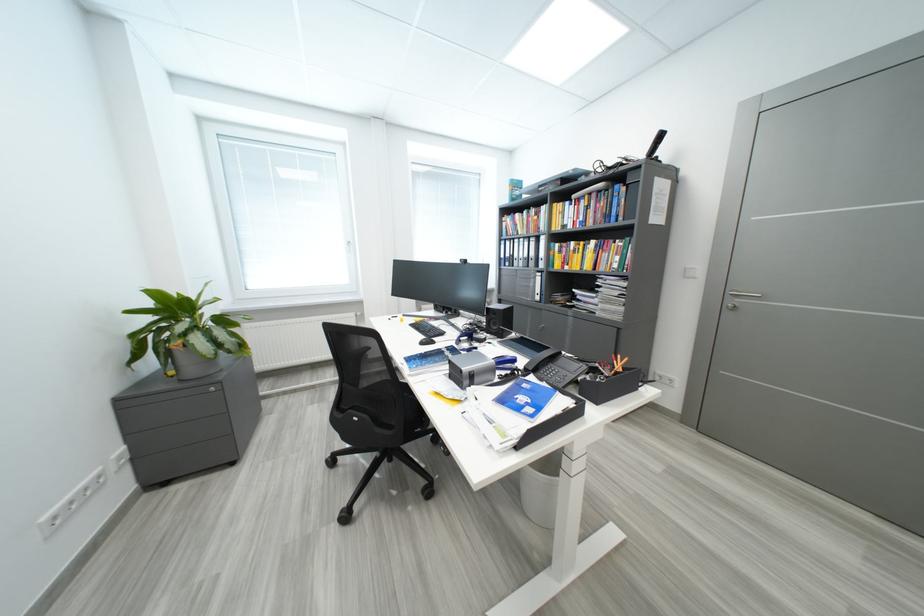
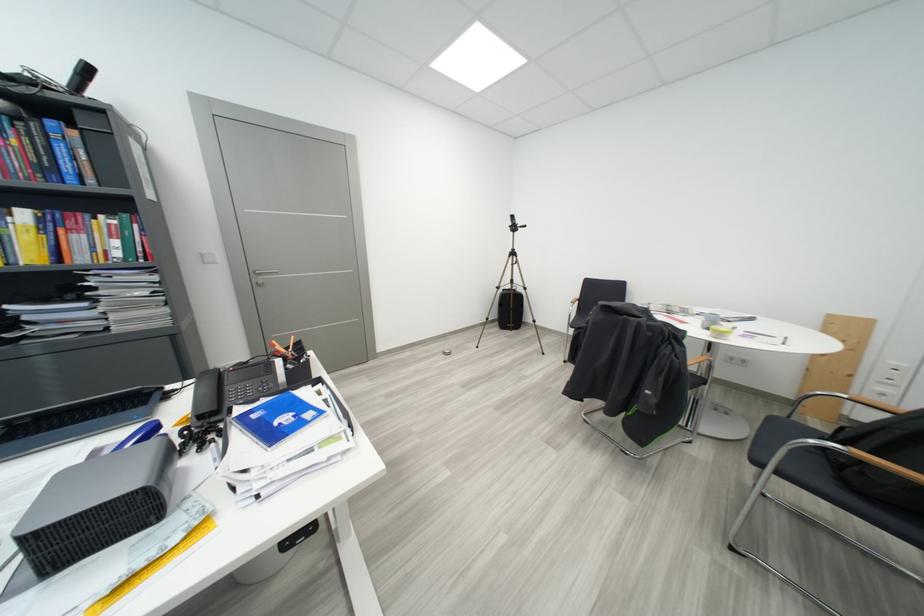
Where in the second image is the point corresponding to point 602,245 from the first image?

(32, 216)